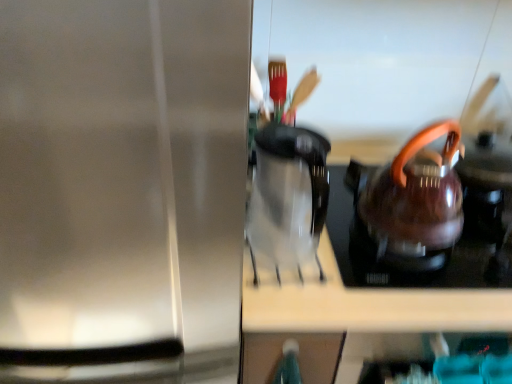
Question: Considering the relative sizes of transparent glass coffee pot at center and stainless steel kettle at right in the image provided, is transparent glass coffee pot at center taller than stainless steel kettle at right?

Choices:
 (A) yes
 (B) no

Answer: (B)

Question: Is transparent glass coffee pot at center not within stainless steel kettle at right?

Choices:
 (A) yes
 (B) no

Answer: (A)

Question: From a real-world perspective, is transparent glass coffee pot at center beneath stainless steel kettle at right?

Choices:
 (A) no
 (B) yes

Answer: (A)

Question: Considering the relative positions of transparent glass coffee pot at center and stainless steel kettle at right in the image provided, is transparent glass coffee pot at center to the left of stainless steel kettle at right from the viewer's perspective?

Choices:
 (A) no
 (B) yes

Answer: (A)

Question: Does transparent glass coffee pot at center lie behind stainless steel kettle at right?

Choices:
 (A) no
 (B) yes

Answer: (B)

Question: Do you think transparent glass coffee pot at center is within shiny metallic kettle at right, or outside of it?

Choices:
 (A) outside
 (B) inside

Answer: (A)

Question: Relative to shiny metallic kettle at right, is transparent glass coffee pot at center in front or behind?

Choices:
 (A) front
 (B) behind

Answer: (A)

Question: From the image's perspective, relative to shiny metallic kettle at right, is transparent glass coffee pot at center above or below?

Choices:
 (A) above
 (B) below

Answer: (B)

Question: From a real-world perspective, relative to shiny metallic kettle at right, is transparent glass coffee pot at center vertically above or below?

Choices:
 (A) below
 (B) above

Answer: (B)

Question: Is point (57, 322) positioned closer to the camera than point (337, 220)?

Choices:
 (A) closer
 (B) farther

Answer: (A)

Question: Would you say stainless steel kettle at right is to the left or to the right of shiny metallic kettle at right in the picture?

Choices:
 (A) right
 (B) left

Answer: (B)

Question: Considering the positions of stainless steel kettle at right and shiny metallic kettle at right in the image, is stainless steel kettle at right bigger or smaller than shiny metallic kettle at right?

Choices:
 (A) big
 (B) small

Answer: (A)

Question: In terms of height, does stainless steel kettle at right look taller or shorter compared to shiny metallic kettle at right?

Choices:
 (A) short
 (B) tall

Answer: (B)

Question: From the image's perspective, is shiny metallic kettle at right above or below transparent glass coffee pot at center?

Choices:
 (A) below
 (B) above

Answer: (B)

Question: In the image, is shiny metallic kettle at right positioned in front of or behind transparent glass coffee pot at center?

Choices:
 (A) front
 (B) behind

Answer: (B)